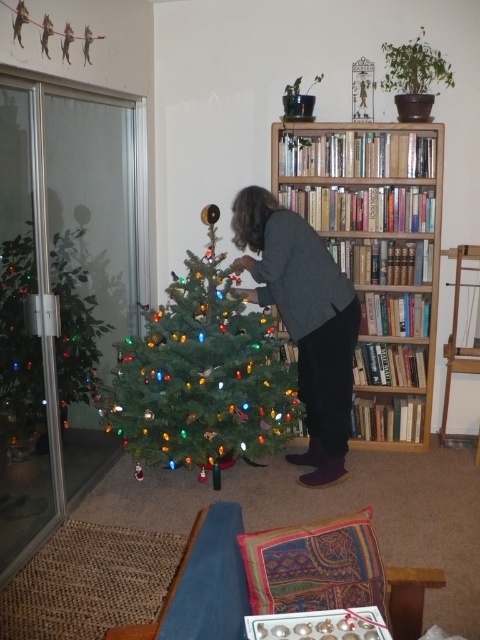
Looking at this image, between wooden bookcase at right and green matte christmas tree at center, which one has less height?

green matte christmas tree at center

Between point (370, 388) and point (113, 422), which one is positioned in front?

Point (113, 422) is more forward.

Identify the location of wooden bookcase at right. The height and width of the screenshot is (640, 480). (375, 253).

Which of these two, wooden bookcase at right or dark gray sweater at center, stands taller?

Standing taller between the two is wooden bookcase at right.

Can you confirm if wooden bookcase at right is positioned above dark gray sweater at center?

Yes, wooden bookcase at right is above dark gray sweater at center.

Locate an element on the screen. Image resolution: width=480 pixels, height=640 pixels. wooden bookcase at right is located at coordinates (375, 253).

Is point (201, 435) positioned in front of point (292, 246)?

No, it is not.

Between green matte christmas tree at center and dark gray sweater at center, which one is positioned higher?

dark gray sweater at center

Locate an element on the screen. The image size is (480, 640). green matte christmas tree at center is located at coordinates 201,374.

I want to click on green matte christmas tree at center, so click(201, 374).